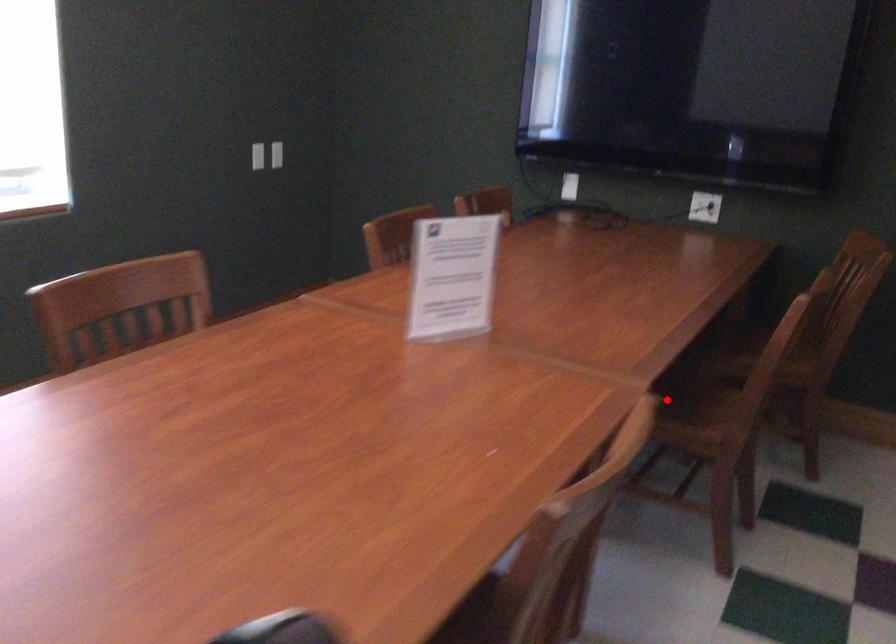
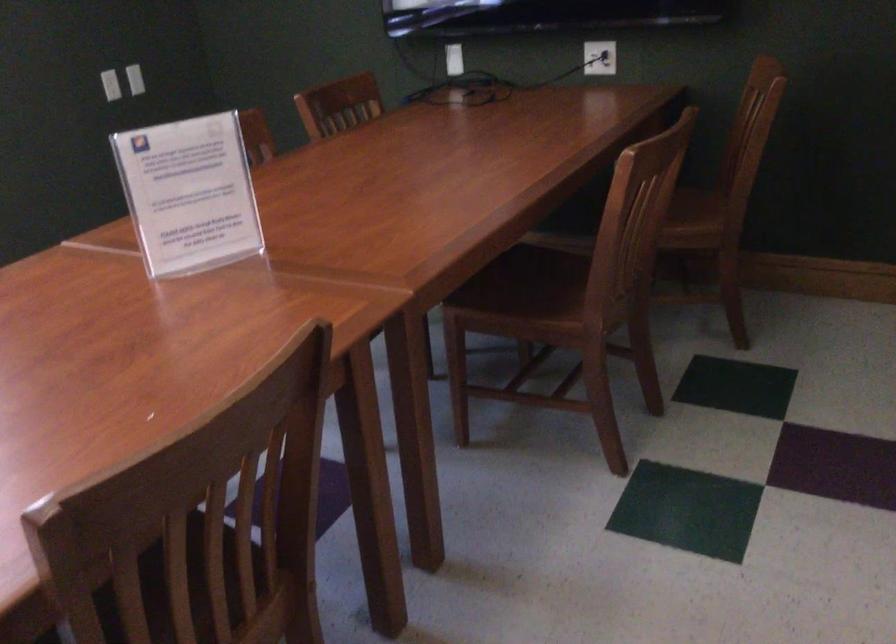
Question: I am providing you with two images of the same scene from different viewpoints. A red point is marked on the first image. At the location where the point appears in image 1, is it still visible in image 2?

Choices:
 (A) Yes
 (B) No

Answer: (A)